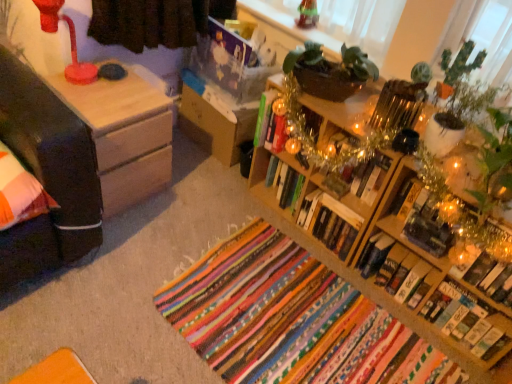
What are the coordinates of `empty space that is ontop of multicolored woven rug at center` in the screenshot? It's located at (271, 313).